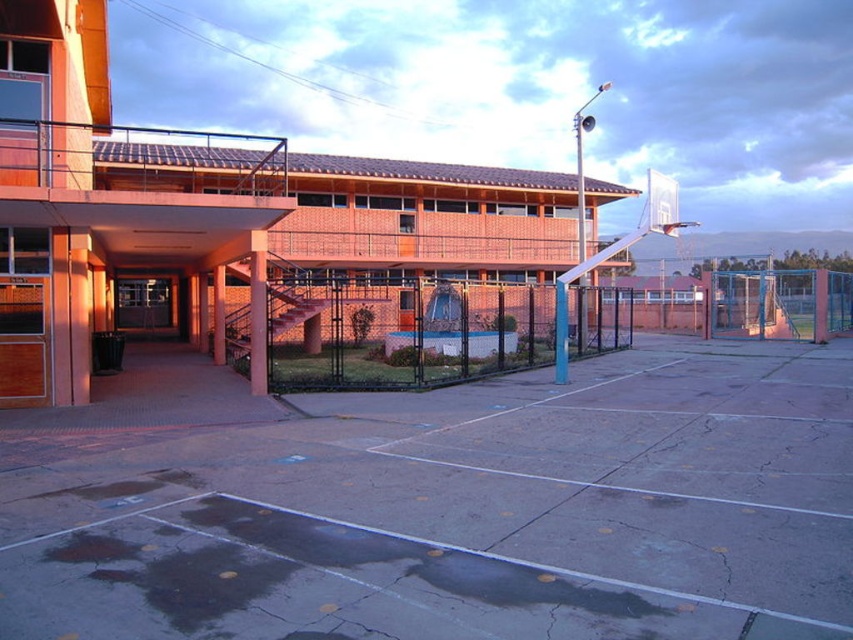
Question: Which point is closer to the camera?

Choices:
 (A) click(242, 422)
 (B) click(287, 353)

Answer: (A)

Question: Among these points, which one is nearest to the camera?

Choices:
 (A) (576, 588)
 (B) (598, 323)

Answer: (A)

Question: Is concrete at center to the right of black wire mesh fence at center from the viewer's perspective?

Choices:
 (A) no
 (B) yes

Answer: (B)

Question: Is concrete at center bigger than black wire mesh fence at center?

Choices:
 (A) yes
 (B) no

Answer: (B)

Question: Is concrete at center below black wire mesh fence at center?

Choices:
 (A) yes
 (B) no

Answer: (A)